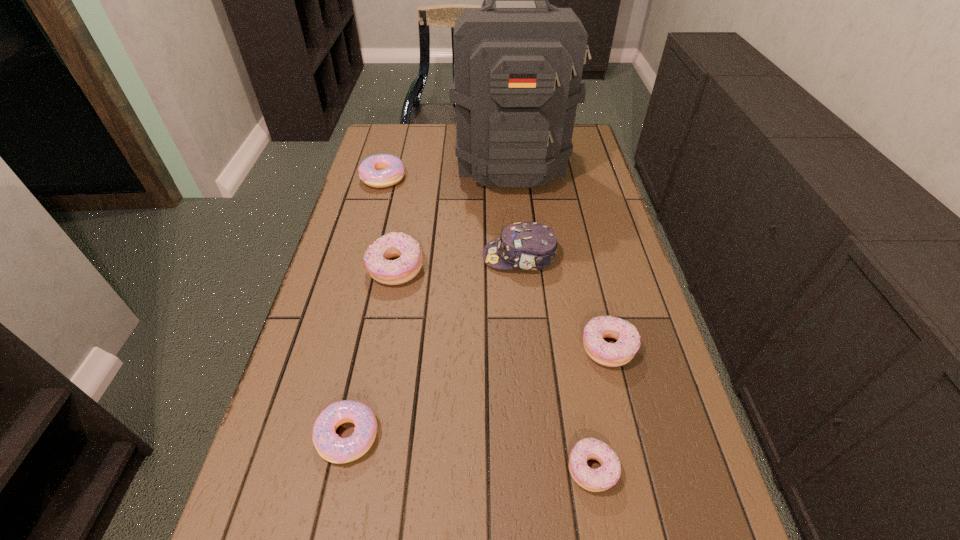
Where is `object that is at the far edge`? object that is at the far edge is located at coordinates coord(517,71).

You are a GUI agent. You are given a task and a screenshot of the screen. Output one action in this format:
    pyautogui.click(x=<x>, y=<y>)
    Task: Click on the backpack that is positioned at the right edge
    The width and height of the screenshot is (960, 540).
    Given the screenshot: What is the action you would take?
    pyautogui.click(x=517, y=71)

Where is `object present at the far right corner`? The height and width of the screenshot is (540, 960). object present at the far right corner is located at coordinates (517, 71).

Identify the location of vacant space at the far edge. (430, 154).

This screenshot has width=960, height=540. Find the location of `vacant space at the left edge of the desktop`. vacant space at the left edge of the desktop is located at coordinates (344, 310).

In order to click on free location at the far right corner in this screenshot , I will do `click(582, 125)`.

Find the location of a particular element. vacant area that lies between the sixth shortest object and the smallest purple doughnut is located at coordinates (556, 363).

At what (x,y) coordinates should I click in order to perform the action: click on vacant area that lies between the smaller pink doughnut and the third tallest object. Please return your answer as a coordinate pair (x, y). The height and width of the screenshot is (540, 960). Looking at the image, I should click on (372, 352).

Image resolution: width=960 pixels, height=540 pixels. I want to click on free space between the sixth shortest object and the smaller pink doughnut, so [x=433, y=346].

This screenshot has height=540, width=960. What are the coordinates of `vacant region between the nearest purple doughnut and the nearer pink doughnut` in the screenshot? It's located at (469, 453).